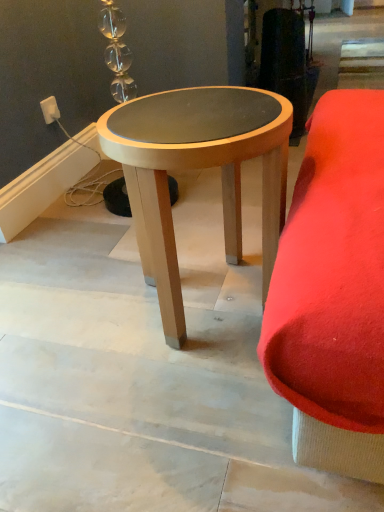
Question: From a real-world perspective, is white plastic outlet at upper left above or below light wood/woodenobject at center?

Choices:
 (A) above
 (B) below

Answer: (A)

Question: Relative to light wood/woodenobject at center, is white plastic outlet at upper left in front or behind?

Choices:
 (A) behind
 (B) front

Answer: (A)

Question: Is white plastic outlet at upper left taller or shorter than light wood/woodenobject at center?

Choices:
 (A) short
 (B) tall

Answer: (A)

Question: From a real-world perspective, is light wood/woodenobject at center physically located above or below white plastic outlet at upper left?

Choices:
 (A) above
 (B) below

Answer: (B)

Question: Based on their positions, is light wood/woodenobject at center located to the left or right of white plastic outlet at upper left?

Choices:
 (A) left
 (B) right

Answer: (B)

Question: From the image's perspective, is light wood/woodenobject at center above or below white plastic outlet at upper left?

Choices:
 (A) above
 (B) below

Answer: (B)

Question: Is light wood/woodenobject at center inside or outside of white plastic outlet at upper left?

Choices:
 (A) outside
 (B) inside

Answer: (A)